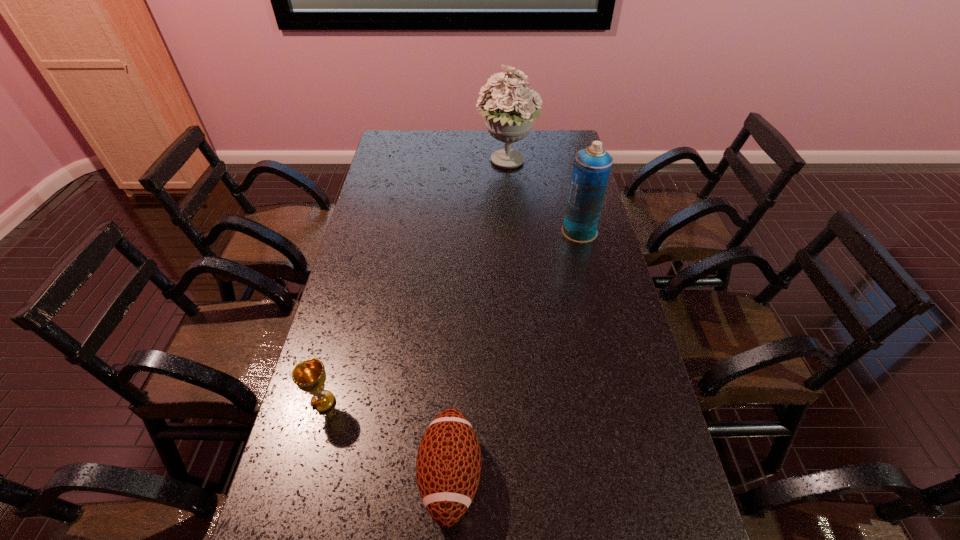
Locate an element on the screen. This screenshot has height=540, width=960. object that is at the far edge is located at coordinates (509, 118).

Identify the location of object that is positioned at the left edge. (309, 376).

Where is `object situated at the right edge`? object situated at the right edge is located at coordinates (591, 168).

In the image, there is a desktop. At what (x,y) coordinates should I click in order to perform the action: click on free space at the far edge. Please return your answer as a coordinate pair (x, y). Looking at the image, I should click on (493, 150).

At what (x,y) coordinates should I click in order to perform the action: click on blank area at the left edge. Please return your answer as a coordinate pair (x, y). The height and width of the screenshot is (540, 960). Looking at the image, I should click on (348, 397).

This screenshot has height=540, width=960. In the image, there is a desktop. Identify the location of free region at the right edge. (613, 269).

This screenshot has height=540, width=960. What are the coordinates of `vacant space at the far right corner` in the screenshot? It's located at (540, 137).

The image size is (960, 540). I want to click on free spot between the third farthest object and the football, so click(387, 439).

Identify the location of vacant space that is in between the second nearest object and the nearest object. (387, 439).

The image size is (960, 540). I want to click on free space between the rightmost object and the leftmost object, so click(451, 317).